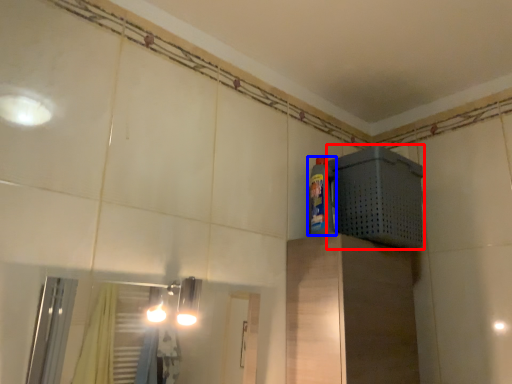
Question: Which object is closer to the camera taking this photo, appliance (highlighted by a red box) or bottle (highlighted by a blue box)?

Choices:
 (A) appliance
 (B) bottle

Answer: (A)